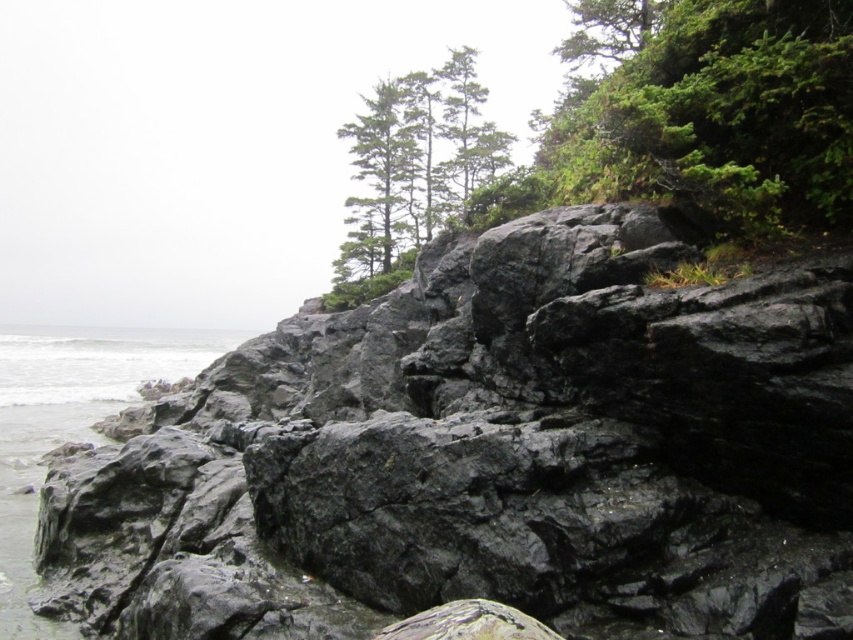
Does green leafy tree at upper right come behind gray rock at lower left?

That is False.

Who is taller, green leafy tree at upper right or gray rock at lower left?

green leafy tree at upper right is taller.

Measure the distance between green leafy tree at upper right and camera.

green leafy tree at upper right and camera are 7.15 meters apart from each other.

Locate an element on the screen. green leafy tree at upper right is located at coordinates (712, 109).

Can you confirm if green leafy tree at upper right is positioned to the left of green matte tree at upper center?

In fact, green leafy tree at upper right is to the right of green matte tree at upper center.

Between green leafy tree at upper right and green matte tree at upper center, which one has less height?

With less height is green leafy tree at upper right.

Between point (817, 115) and point (450, 186), which one is positioned in front?

Positioned in front is point (817, 115).

This screenshot has height=640, width=853. What are the coordinates of `green leafy tree at upper right` in the screenshot? It's located at (712, 109).

Which is more to the left, black rough rock at center or green matte tree at upper center?

black rough rock at center

Is black rough rock at center to the right of green matte tree at upper center from the viewer's perspective?

Incorrect, black rough rock at center is not on the right side of green matte tree at upper center.

The image size is (853, 640). I want to click on black rough rock at center, so click(488, 456).